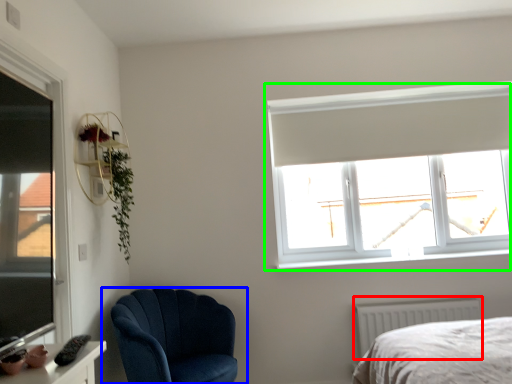
Question: Considering the real-world distances, which object is closest to radiator (highlighted by a red box)? chair (highlighted by a blue box) or window (highlighted by a green box).

Choices:
 (A) chair
 (B) window

Answer: (B)